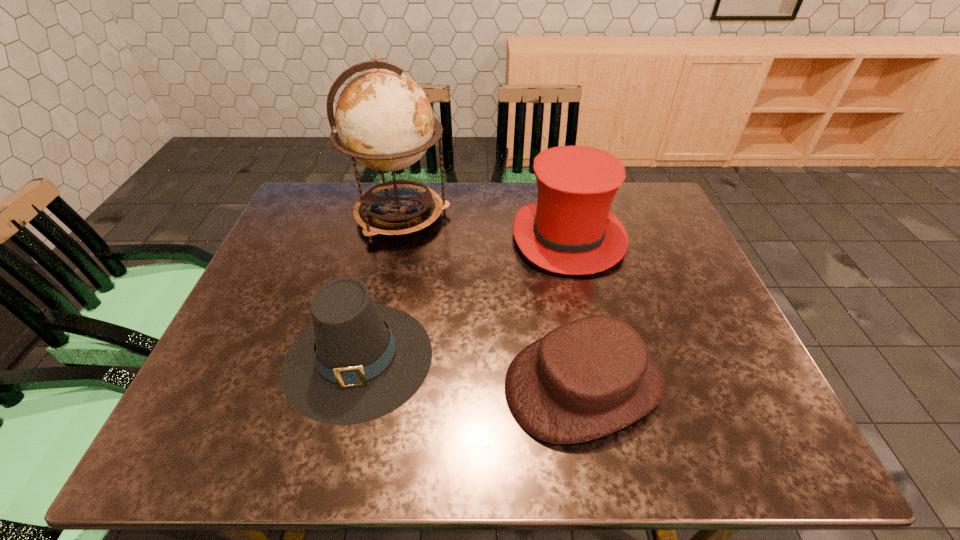
Where is `object identified as the second closest to the globe`? The width and height of the screenshot is (960, 540). object identified as the second closest to the globe is located at coordinates (358, 361).

The image size is (960, 540). Identify the location of the third closest object to the globe. (591, 377).

Locate an element on the screen. hat that is the closest one to the globe is located at coordinates (570, 230).

Point out which hat is positioned as the nearest to the shortest hat. Please provide its 2D coordinates. Your answer should be formatted as a tuple, i.e. [(x, y)], where the tuple contains the x and y coordinates of a point satisfying the conditions above.

[(358, 361)]

At what (x,y) coordinates should I click in order to perform the action: click on vacant space that satisfies the following two spatial constraints: 1. at the center of the tallest object; 2. on the front-facing side of the leftmost hat. Please return your answer as a coordinate pair (x, y). The image size is (960, 540). Looking at the image, I should click on (371, 358).

Where is `free point that satisfies the following two spatial constraints: 1. at the center of the globe; 2. on the right side of the shortest hat`? The image size is (960, 540). free point that satisfies the following two spatial constraints: 1. at the center of the globe; 2. on the right side of the shortest hat is located at coordinates (365, 383).

At what (x,y) coordinates should I click in order to perform the action: click on free space that satisfies the following two spatial constraints: 1. at the center of the third shortest object; 2. on the left side of the tallest object. Please return your answer as a coordinate pair (x, y). The image size is (960, 540). Looking at the image, I should click on (396, 238).

Where is `vacant space that satisfies the following two spatial constraints: 1. at the center of the shortest hat; 2. on the right side of the tallest object`? The height and width of the screenshot is (540, 960). vacant space that satisfies the following two spatial constraints: 1. at the center of the shortest hat; 2. on the right side of the tallest object is located at coordinates (365, 383).

You are a GUI agent. You are given a task and a screenshot of the screen. Output one action in this format:
    pyautogui.click(x=<x>, y=<y>)
    Task: Click on the vacant position in the image that satisfies the following two spatial constraints: 1. on the front-facing side of the shortest hat; 2. on the right side of the leftmost hat
    The width and height of the screenshot is (960, 540).
    Given the screenshot: What is the action you would take?
    352,383